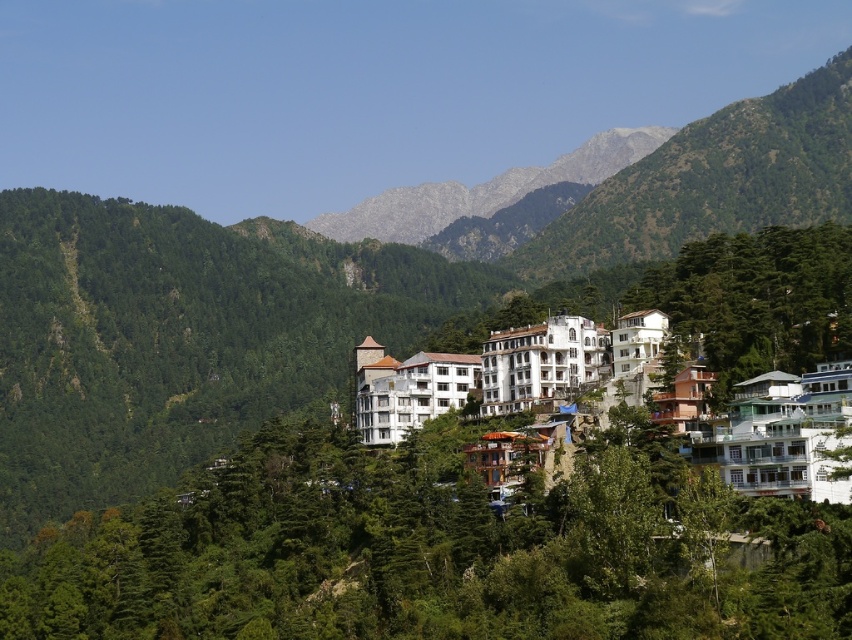
Question: Does green leafy tree at center lie in front of white stone building at center?

Choices:
 (A) yes
 (B) no

Answer: (A)

Question: Is white glossy building at lower right bigger than white glossy building at center?

Choices:
 (A) yes
 (B) no

Answer: (A)

Question: Which object is farther from the camera taking this photo?

Choices:
 (A) white stone building at center
 (B) green leafy tree at center
 (C) white glossy building at center
 (D) green leafy tree at center-right

Answer: (A)

Question: Is white glossy building at center thinner than white stone building at center?

Choices:
 (A) yes
 (B) no

Answer: (A)

Question: Which point appears farthest from the camera in this image?

Choices:
 (A) (372, 390)
 (B) (559, 376)
 (C) (653, 273)

Answer: (C)

Question: Which point is closer to the camera?

Choices:
 (A) pos(413,400)
 (B) pos(579,365)

Answer: (B)